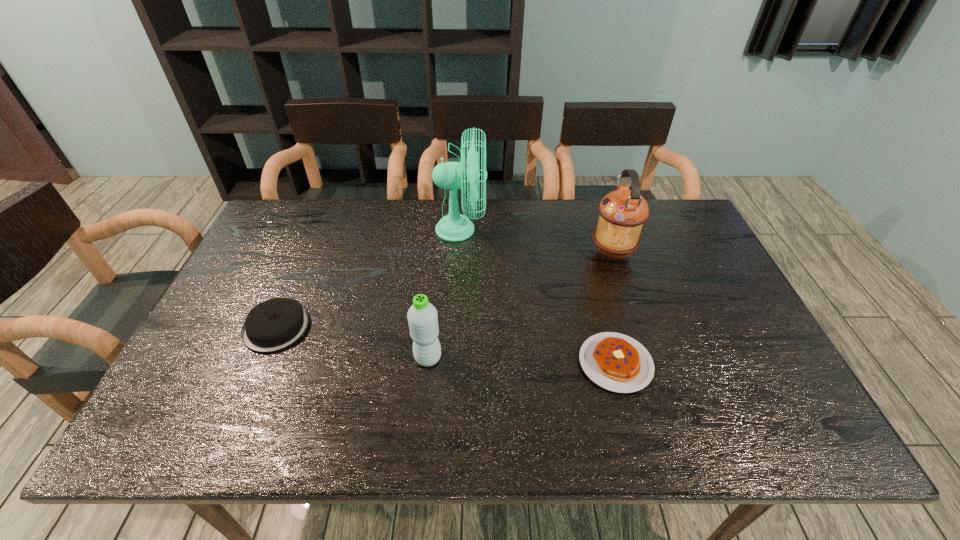
You are a GUI agent. You are given a task and a screenshot of the screen. Output one action in this format:
    pyautogui.click(x=<x>, y=<y>)
    Task: Click on the vacant area that satisfies the following two spatial constraints: 1. on the back side of the shorter pancake; 2. in front of the fan to blow air
    The width and height of the screenshot is (960, 540).
    Given the screenshot: What is the action you would take?
    pyautogui.click(x=580, y=230)

Where is `vacant region that satisfies the following two spatial constraints: 1. in front of the oil lamp to blow air; 2. on the left side of the tallest object`? This screenshot has width=960, height=540. vacant region that satisfies the following two spatial constraints: 1. in front of the oil lamp to blow air; 2. on the left side of the tallest object is located at coordinates (460, 253).